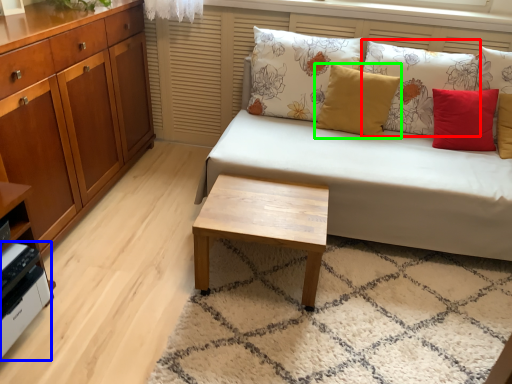
Question: Estimate the real-world distances between objects in this image. Which object is farther from pillow (highlighted by a red box), appliance (highlighted by a blue box) or pillow (highlighted by a green box)?

Choices:
 (A) appliance
 (B) pillow

Answer: (A)